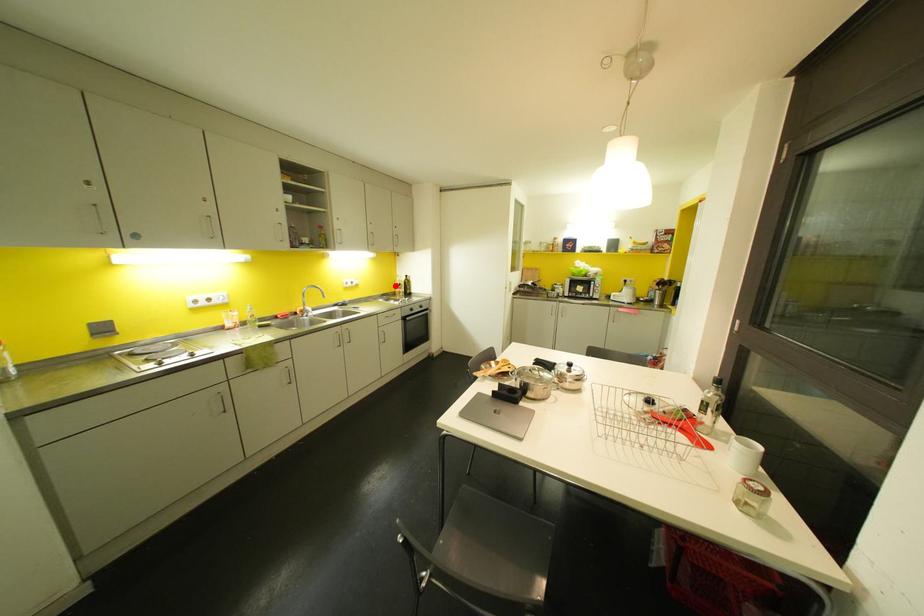
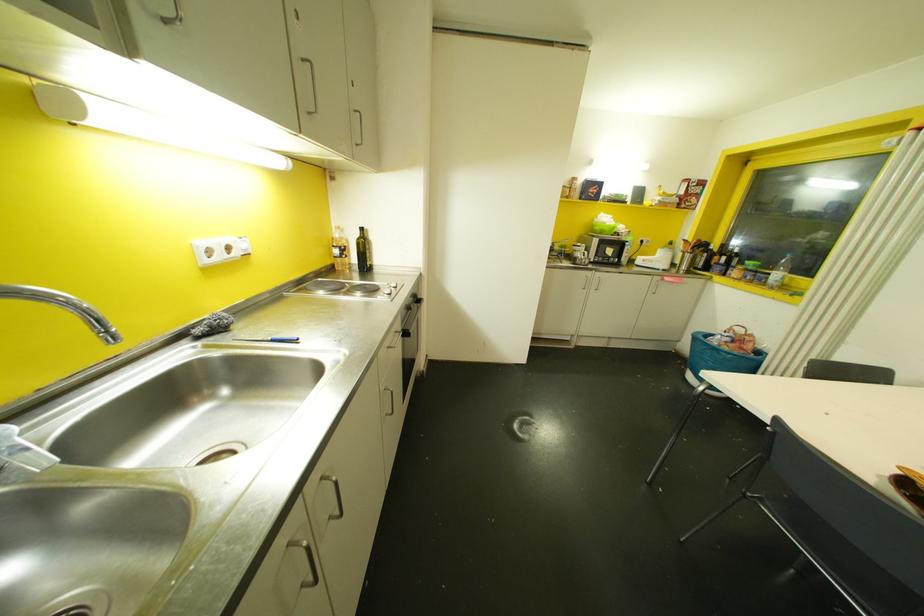
Find the pixel in the second image that matches the highlighted location in the first image.

(335, 251)